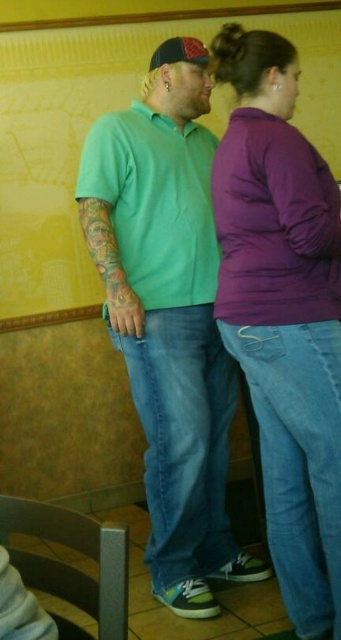
Between green matte shirt at center and purple fleece at center, which one is positioned higher?

Positioned higher is purple fleece at center.

Image resolution: width=341 pixels, height=640 pixels. In order to click on green matte shirt at center in this screenshot , I will do `click(169, 323)`.

You are a GUI agent. You are given a task and a screenshot of the screen. Output one action in this format:
    pyautogui.click(x=<x>, y=<y>)
    Task: Click on the green matte shirt at center
    
    Given the screenshot: What is the action you would take?
    pyautogui.click(x=169, y=323)

How much distance is there between purple fleece at center and matte black baseball cap at upper center?

They are 33.30 inches apart.

You are a GUI agent. You are given a task and a screenshot of the screen. Output one action in this format:
    pyautogui.click(x=<x>, y=<y>)
    Task: Click on the purple fleece at center
    This screenshot has width=341, height=640.
    Given the screenshot: What is the action you would take?
    284,314

Does point (247, 177) lie in front of point (191, 44)?

Yes, point (247, 177) is closer to viewer.

Where is `purple fleece at center`? This screenshot has width=341, height=640. purple fleece at center is located at coordinates (284, 314).

Does green matte shirt at center have a greater height compared to matte black baseball cap at upper center?

Correct, green matte shirt at center is much taller as matte black baseball cap at upper center.

Is green matte shirt at center wider than matte black baseball cap at upper center?

Yes.

Between point (90, 248) and point (180, 51), which one is positioned in front?

Point (90, 248)

Where is `green matte shirt at center`? The image size is (341, 640). green matte shirt at center is located at coordinates (169, 323).